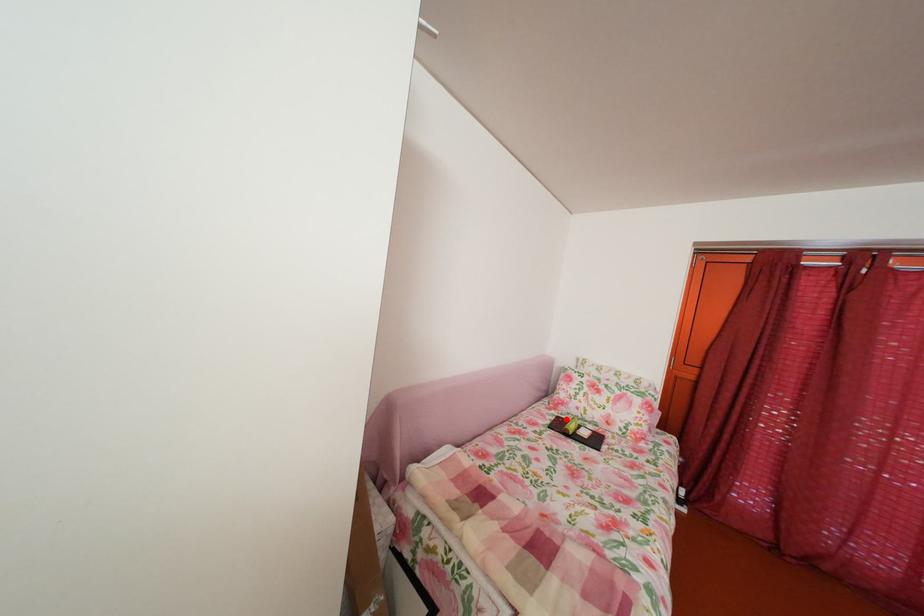
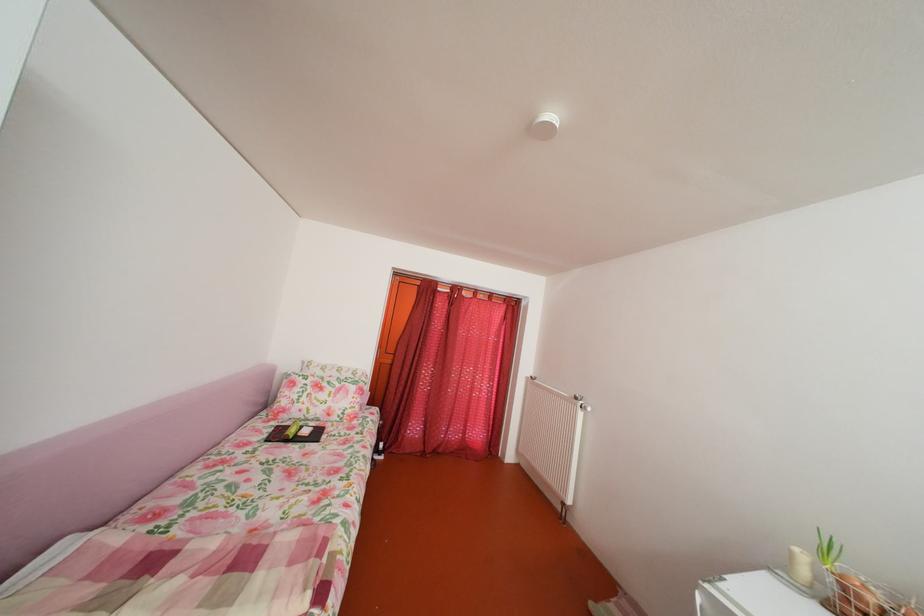
Locate, in the second image, the point that corresponds to the highlighted location in the first image.

(286, 430)